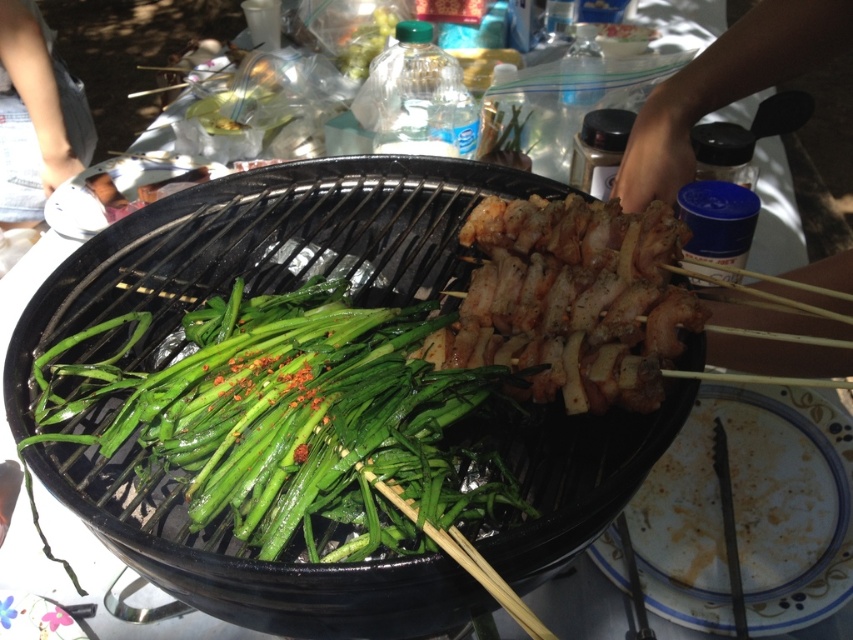
Question: Which object is closer to the camera taking this photo?

Choices:
 (A) white matte phone at upper left
 (B) green glossy vegetables at center

Answer: (B)

Question: Which point is closer to the camera?

Choices:
 (A) (49, 154)
 (B) (651, 260)

Answer: (B)

Question: In this image, where is green glossy vegetables at center located relative to white matte phone at upper left?

Choices:
 (A) left
 (B) right

Answer: (B)

Question: Does green glossy vegetables at center lie in front of white matte phone at upper left?

Choices:
 (A) yes
 (B) no

Answer: (A)

Question: Which is nearer to the grilled meat at center?

Choices:
 (A) white matte phone at upper left
 (B) green glossy vegetables at center

Answer: (B)

Question: Can you confirm if grilled meat at center is wider than white matte phone at upper left?

Choices:
 (A) yes
 (B) no

Answer: (B)